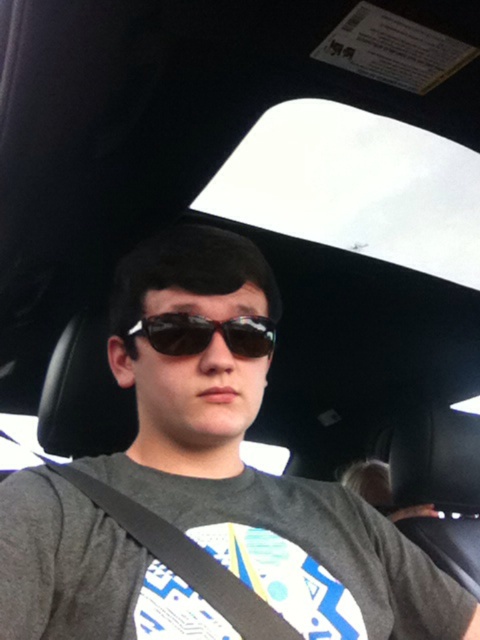
Question: Does black fabric seatbelt at center have a smaller size compared to sunglasses at center?

Choices:
 (A) yes
 (B) no

Answer: (B)

Question: Which point appears farthest from the camera in this image?

Choices:
 (A) pyautogui.click(x=145, y=476)
 (B) pyautogui.click(x=240, y=336)

Answer: (A)

Question: Based on their relative distances, which object is nearer to the matte black sunglasses at center?

Choices:
 (A) black fabric seatbelt at center
 (B) sunglasses at center

Answer: (A)

Question: Does black fabric seatbelt at center appear on the left side of sunglasses at center?

Choices:
 (A) yes
 (B) no

Answer: (A)

Question: Where is matte black sunglasses at center located in relation to sunglasses at center in the image?

Choices:
 (A) below
 (B) above

Answer: (A)

Question: Which of the following is the farthest from the observer?

Choices:
 (A) (272, 608)
 (B) (354, 544)
 (C) (167, 346)

Answer: (B)